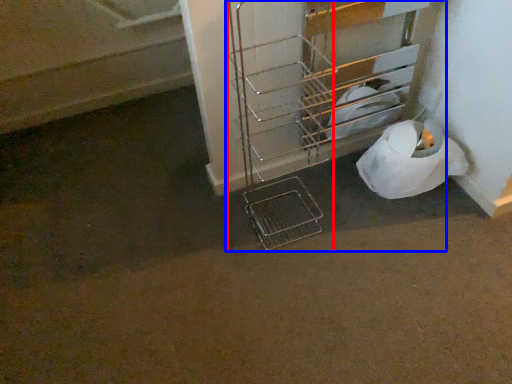
Question: Which of the following is the closest to the observer, trolley (highlighted by a red box) or trolley (highlighted by a blue box)?

Choices:
 (A) trolley
 (B) trolley

Answer: (A)